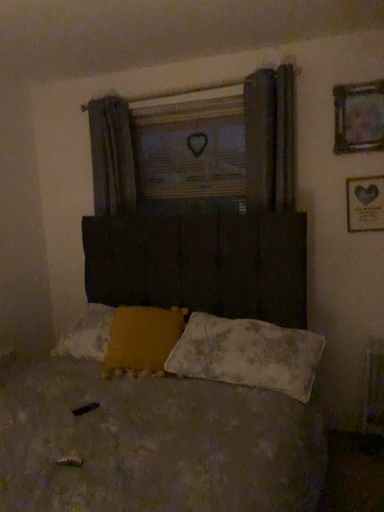
Question: Considering the relative sizes of worn fabric bed at center and wooden heart at center in the image provided, is worn fabric bed at center thinner than wooden heart at center?

Choices:
 (A) yes
 (B) no

Answer: (B)

Question: From the image's perspective, is worn fabric bed at center on wooden heart at center?

Choices:
 (A) yes
 (B) no

Answer: (B)

Question: Considering the relative sizes of worn fabric bed at center and wooden heart at center in the image provided, is worn fabric bed at center shorter than wooden heart at center?

Choices:
 (A) no
 (B) yes

Answer: (A)

Question: Is worn fabric bed at center with wooden heart at center?

Choices:
 (A) no
 (B) yes

Answer: (A)

Question: Is worn fabric bed at center at the right side of wooden heart at center?

Choices:
 (A) yes
 (B) no

Answer: (B)

Question: Is point (354, 115) closer or farther from the camera than point (112, 337)?

Choices:
 (A) closer
 (B) farther

Answer: (B)

Question: Is metallic silver picture frame at upper right, the 2th picture frame when ordered from bottom to top, inside the boundaries of yellow fuzzy pillow at lower center, positioned as the 2th pillow in right-to-left order, or outside?

Choices:
 (A) outside
 (B) inside

Answer: (A)

Question: Considering the relative positions of metallic silver picture frame at upper right, the 1th picture frame from the top, and yellow fuzzy pillow at lower center, which is the first pillow from left to right, in the image provided, is metallic silver picture frame at upper right, the 1th picture frame from the top, to the left or to the right of yellow fuzzy pillow at lower center, which is the first pillow from left to right,?

Choices:
 (A) left
 (B) right

Answer: (B)

Question: From the image's perspective, relative to yellow fuzzy pillow at lower center, positioned as the 2th pillow in right-to-left order, is metallic silver picture frame at upper right, the 2th picture frame when ordered from bottom to top, above or below?

Choices:
 (A) above
 (B) below

Answer: (A)

Question: Considering the positions of gold metallic picture frame at upper right, which is the 2th picture frame in top-to-bottom order, and worn fabric bed at center in the image, is gold metallic picture frame at upper right, which is the 2th picture frame in top-to-bottom order, taller or shorter than worn fabric bed at center?

Choices:
 (A) tall
 (B) short

Answer: (B)

Question: Is gold metallic picture frame at upper right, which is the 2th picture frame in top-to-bottom order, situated inside worn fabric bed at center or outside?

Choices:
 (A) inside
 (B) outside

Answer: (B)

Question: Considering their positions, is gold metallic picture frame at upper right, which is the 2th picture frame in top-to-bottom order, located in front of or behind worn fabric bed at center?

Choices:
 (A) behind
 (B) front

Answer: (A)

Question: Looking at their shapes, would you say gold metallic picture frame at upper right, which is the 2th picture frame in top-to-bottom order, is wider or thinner than worn fabric bed at center?

Choices:
 (A) thin
 (B) wide

Answer: (A)

Question: From the image's perspective, relative to worn fabric pillow at lower center, arranged as the 2th pillow when viewed from the left, is wooden heart at center above or below?

Choices:
 (A) above
 (B) below

Answer: (A)

Question: Based on their positions, is wooden heart at center located to the left or right of worn fabric pillow at lower center, arranged as the 2th pillow when viewed from the left?

Choices:
 (A) left
 (B) right

Answer: (A)